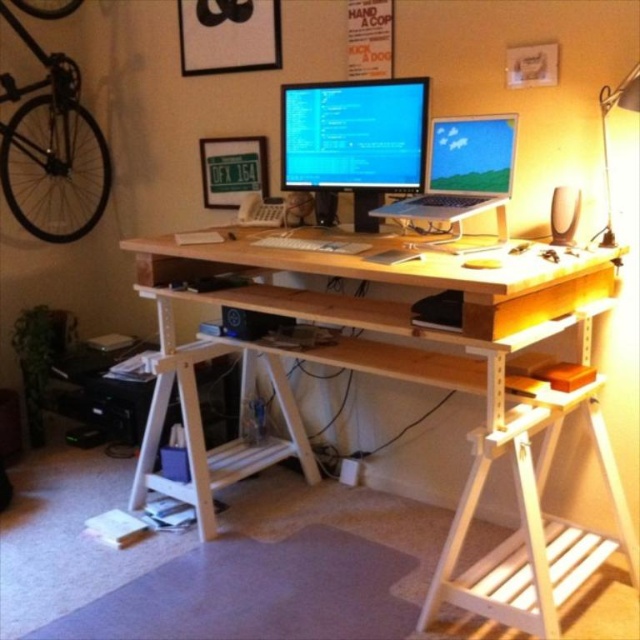
Is light wood/woodencomputer desk at center below black matte bicycle at upper left?

Indeed, light wood/woodencomputer desk at center is positioned under black matte bicycle at upper left.

Does light wood/woodencomputer desk at center come behind black matte bicycle at upper left?

No, it is not.

Is point (474, 596) farther from viewer compared to point (16, 1)?

No, it is in front of (16, 1).

The image size is (640, 640). I want to click on light wood/woodencomputer desk at center, so 406,380.

Does black matte bicycle at upper left have a larger size compared to metallic silver desk lamp at upper right?

Yes, black matte bicycle at upper left is bigger than metallic silver desk lamp at upper right.

Is the position of black matte bicycle at upper left more distant than that of metallic silver desk lamp at upper right?

Yes, black matte bicycle at upper left is behind metallic silver desk lamp at upper right.

Does point (61, 198) come in front of point (630, 131)?

No, it is not.

At what (x,y) coordinates should I click in order to perform the action: click on black matte bicycle at upper left. Please return your answer as a coordinate pair (x, y). Looking at the image, I should click on point(51,148).

Does point (42, 157) come in front of point (404, 198)?

That is False.

Which is more to the left, black matte bicycle at upper left or matte black laptop at center?

black matte bicycle at upper left

Is point (48, 168) less distant than point (449, 134)?

No, (48, 168) is behind (449, 134).

Find the location of a particular element. The width and height of the screenshot is (640, 640). black matte bicycle at upper left is located at coordinates (51, 148).